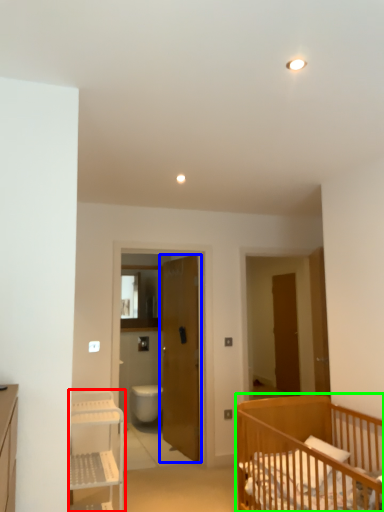
Question: Which is nearer to the shelf (highlighted by a red box)? door (highlighted by a blue box) or infant bed (highlighted by a green box).

Choices:
 (A) door
 (B) infant bed

Answer: (B)